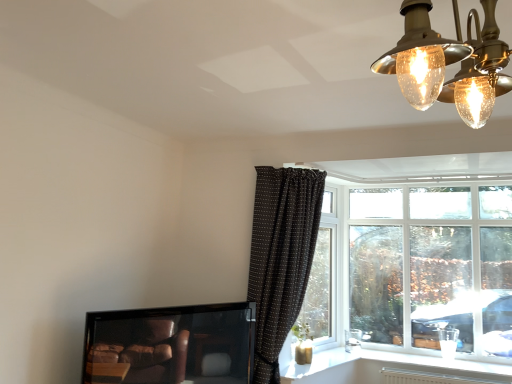
Question: From a real-world perspective, is gold textured chandelier at upper right positioned under white plastic window sill at lower right based on gravity?

Choices:
 (A) yes
 (B) no

Answer: (B)

Question: Is gold textured chandelier at upper right shorter than white plastic window sill at lower right?

Choices:
 (A) no
 (B) yes

Answer: (A)

Question: From the image's perspective, would you say gold textured chandelier at upper right is shown under white plastic window sill at lower right?

Choices:
 (A) yes
 (B) no

Answer: (B)

Question: Is the position of gold textured chandelier at upper right less distant than that of white plastic window sill at lower right?

Choices:
 (A) no
 (B) yes

Answer: (B)

Question: Does gold textured chandelier at upper right contain white plastic window sill at lower right?

Choices:
 (A) yes
 (B) no

Answer: (B)

Question: From the image's perspective, is white plastic window sill at lower right positioned above or below gold textured chandelier at upper right?

Choices:
 (A) above
 (B) below

Answer: (B)

Question: Is white plastic window sill at lower right inside or outside of gold textured chandelier at upper right?

Choices:
 (A) outside
 (B) inside

Answer: (A)

Question: In terms of height, does white plastic window sill at lower right look taller or shorter compared to gold textured chandelier at upper right?

Choices:
 (A) tall
 (B) short

Answer: (B)

Question: Is white plastic window sill at lower right wider or thinner than gold textured chandelier at upper right?

Choices:
 (A) thin
 (B) wide

Answer: (B)

Question: In terms of height, does brown dotted fabric curtain at upper center look taller or shorter compared to white plastic window sill at lower right?

Choices:
 (A) short
 (B) tall

Answer: (B)

Question: Looking at their shapes, would you say brown dotted fabric curtain at upper center is wider or thinner than white plastic window sill at lower right?

Choices:
 (A) wide
 (B) thin

Answer: (A)

Question: Considering their positions, is brown dotted fabric curtain at upper center located in front of or behind white plastic window sill at lower right?

Choices:
 (A) front
 (B) behind

Answer: (A)

Question: Looking at the image, does brown dotted fabric curtain at upper center seem bigger or smaller compared to white plastic window sill at lower right?

Choices:
 (A) small
 (B) big

Answer: (B)

Question: From the image's perspective, is gold textured chandelier at upper right above or below white plastic window at upper right?

Choices:
 (A) below
 (B) above

Answer: (B)

Question: Do you think gold textured chandelier at upper right is within white plastic window at upper right, or outside of it?

Choices:
 (A) outside
 (B) inside

Answer: (A)